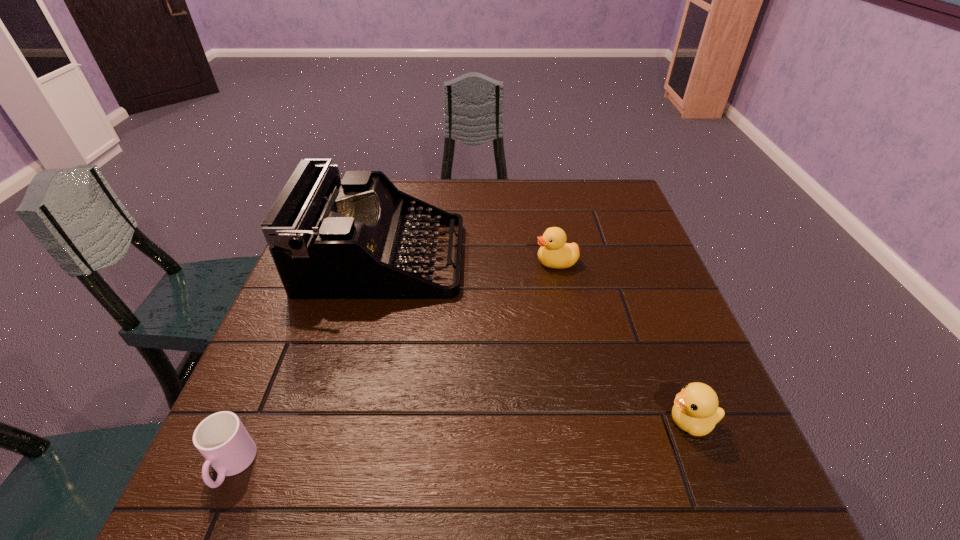
Image resolution: width=960 pixels, height=540 pixels. What are the coordinates of `vacant space positioned on the face of the nearer duck` in the screenshot? It's located at (598, 422).

This screenshot has height=540, width=960. Identify the location of vacant space located 0.370m on the face of the nearer duck. (462, 422).

I want to click on vacant space located 0.160m on the face of the nearer duck, so click(576, 422).

I want to click on object that is at the near edge, so click(x=222, y=439).

At what (x,y) coordinates should I click in order to perform the action: click on typewriter that is positioned at the left edge. Please return your answer as a coordinate pair (x, y). This screenshot has width=960, height=540. Looking at the image, I should click on (329, 239).

At what (x,y) coordinates should I click in order to perform the action: click on cup located in the left edge section of the desktop. Please return your answer as a coordinate pair (x, y). This screenshot has width=960, height=540. Looking at the image, I should click on (222, 439).

This screenshot has width=960, height=540. What are the coordinates of `object located at the right edge` in the screenshot? It's located at (695, 410).

The width and height of the screenshot is (960, 540). I want to click on object that is at the near left corner, so click(x=222, y=439).

I want to click on free space at the far edge, so click(516, 181).

The width and height of the screenshot is (960, 540). I want to click on vacant space at the near edge of the desktop, so click(x=576, y=483).